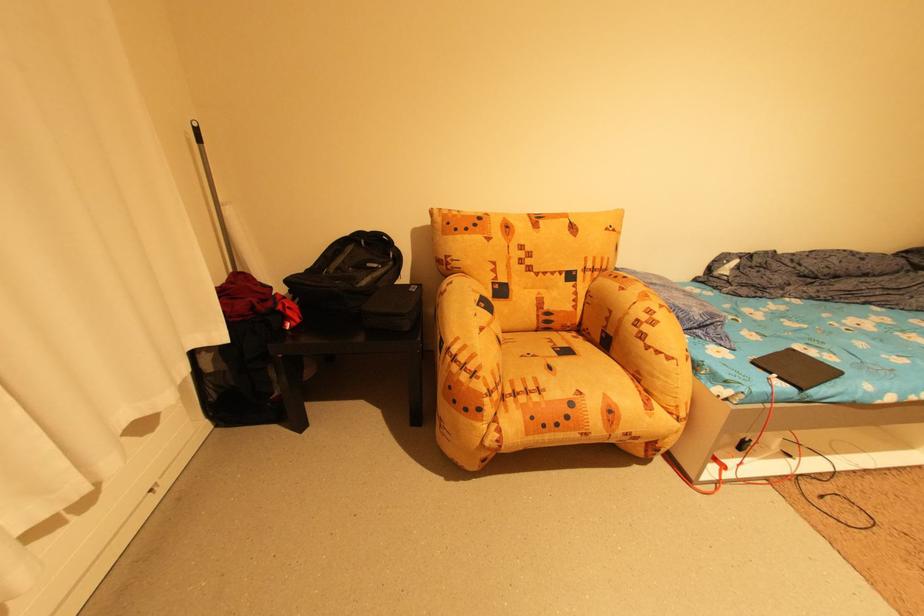
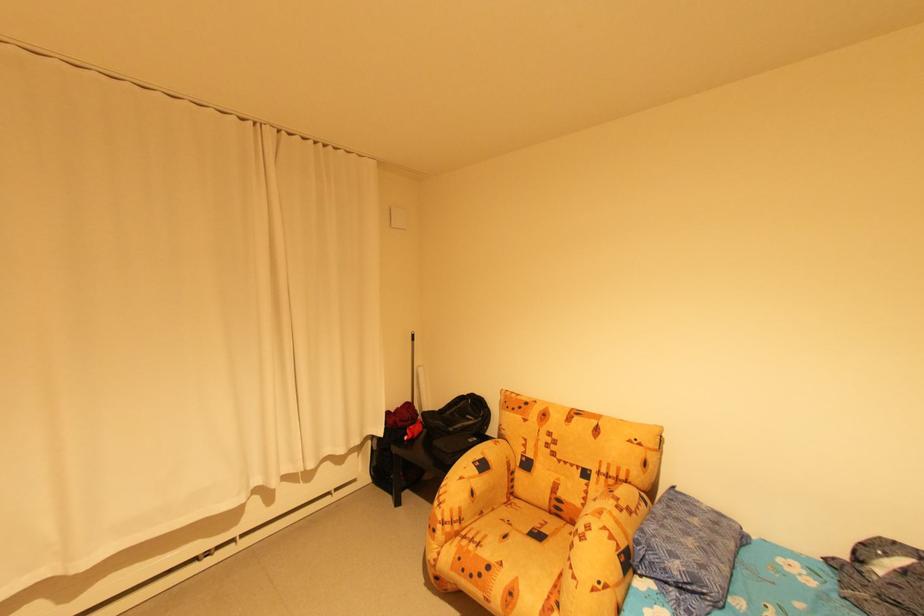
Where in the second image is the point corresponding to (503,397) from the first image?

(456, 529)